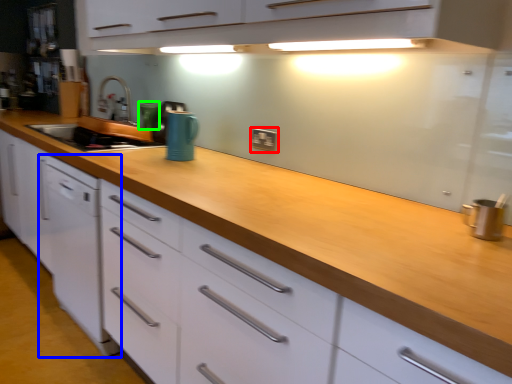
Question: Estimate the real-world distances between objects in this image. Which object is farther from electric outlet (highlighted by a red box), home appliance (highlighted by a blue box) or appliance (highlighted by a green box)?

Choices:
 (A) home appliance
 (B) appliance

Answer: (A)